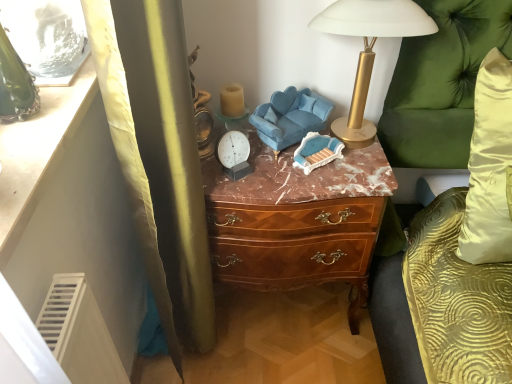
Question: From the image's perspective, does velvet blue swivel chair at center appear higher than green velvet couch at right?

Choices:
 (A) no
 (B) yes

Answer: (B)

Question: From the image's perspective, is velvet blue swivel chair at center below green velvet couch at right?

Choices:
 (A) yes
 (B) no

Answer: (B)

Question: Is green velvet couch at right surrounded by velvet blue swivel chair at center?

Choices:
 (A) yes
 (B) no

Answer: (B)

Question: Is velvet blue swivel chair at center in front of green velvet couch at right?

Choices:
 (A) no
 (B) yes

Answer: (A)

Question: Is velvet blue swivel chair at center oriented towards green velvet couch at right?

Choices:
 (A) yes
 (B) no

Answer: (B)

Question: Is matte white vanity at upper left in front of or behind velvet blue swivel chair at center in the image?

Choices:
 (A) front
 (B) behind

Answer: (A)

Question: From the image's perspective, relative to velvet blue swivel chair at center, is matte white vanity at upper left above or below?

Choices:
 (A) above
 (B) below

Answer: (B)

Question: From a real-world perspective, relative to velvet blue swivel chair at center, is matte white vanity at upper left vertically above or below?

Choices:
 (A) above
 (B) below

Answer: (A)

Question: Do you think matte white vanity at upper left is within velvet blue swivel chair at center, or outside of it?

Choices:
 (A) outside
 (B) inside

Answer: (A)

Question: Is gold metallic lamp at upper right situated inside matte white vanity at upper left or outside?

Choices:
 (A) outside
 (B) inside

Answer: (A)

Question: Looking at the image, does gold metallic lamp at upper right seem bigger or smaller compared to matte white vanity at upper left?

Choices:
 (A) big
 (B) small

Answer: (A)

Question: Does point (317, 18) appear closer or farther from the camera than point (2, 145)?

Choices:
 (A) farther
 (B) closer

Answer: (A)

Question: Visually, is gold metallic lamp at upper right positioned to the left or to the right of matte white vanity at upper left?

Choices:
 (A) right
 (B) left

Answer: (A)

Question: Is velvet blue swivel chair at center inside or outside of green velvet couch at right?

Choices:
 (A) outside
 (B) inside

Answer: (A)

Question: Considering their positions, is velvet blue swivel chair at center located in front of or behind green velvet couch at right?

Choices:
 (A) front
 (B) behind

Answer: (B)